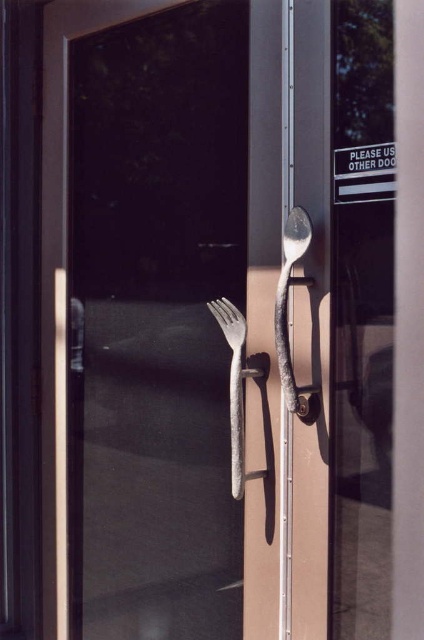
You are holding a 3.5 feet wide cleaning robot. You need to move through the door while avoiding the shiny silver spoon at center. Can your robot fit through the space next to the spoon without touching it? Please explain your reasoning.

The shiny silver spoon at center is 4.09 feet away from the viewer. Since the robot is 3.5 feet wide, there is enough space between the spoon and the door frame to maneuver around it without touching. The robot can pass safely as long as it stays within the available space.

You are trying to open the door but need to choose between the shiny silver spoon at center and the rusty metal fork at center. Which handle is wider?

The rusty metal fork at center is wider than the shiny silver spoon at center.

You are trying to open the door but need to decide which handle to use. The shiny silver spoon at center and the rusty metal fork at center are both on the door. Based on their positions, which handle should you grab first if you want to reach the one closer to you?

The shiny silver spoon at center is closer to the viewer than the rusty metal fork at center, so you should grab the shiny silver spoon at center first.